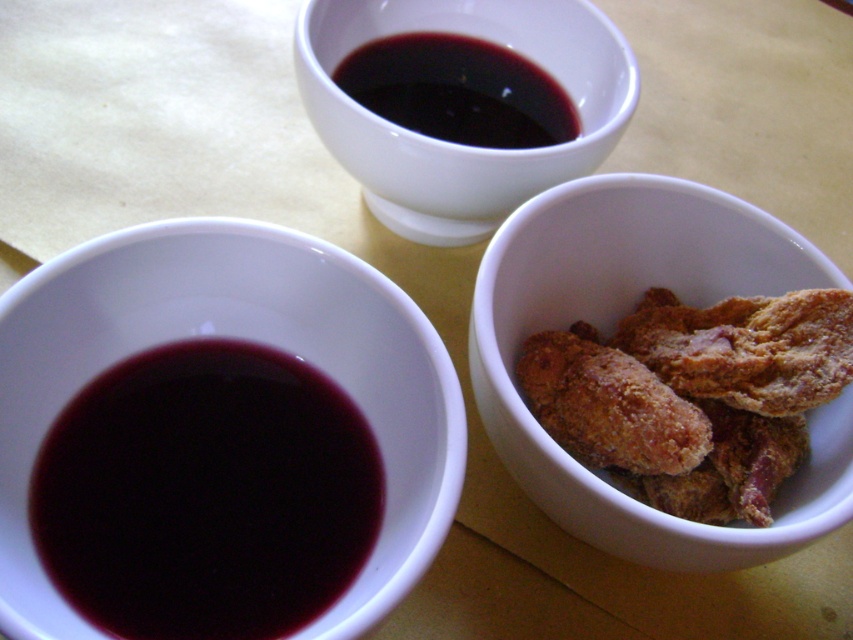
Question: Based on their relative distances, which object is nearer to the dark glossy sauce at upper center?

Choices:
 (A) dark red matte bowl at left
 (B) golden-brown fried snack at center-right
 (C) matte white bowl at upper center

Answer: (C)

Question: Among these objects, which one is nearest to the camera?

Choices:
 (A) golden-brown fried snack at center-right
 (B) dark red matte bowl at left
 (C) dark glossy sauce at upper center

Answer: (B)

Question: Which object is positioned closest to the dark red matte bowl at left?

Choices:
 (A) matte white bowl at upper center
 (B) golden-brown fried snack at center-right
 (C) dark glossy sauce at upper center

Answer: (B)

Question: Considering the relative positions of golden-brown fried snack at center-right and matte white bowl at upper center in the image provided, where is golden-brown fried snack at center-right located with respect to matte white bowl at upper center?

Choices:
 (A) below
 (B) above

Answer: (A)

Question: Is matte white bowl at upper center thinner than dark glossy sauce at upper center?

Choices:
 (A) no
 (B) yes

Answer: (A)

Question: Can you confirm if dark red matte bowl at left is thinner than dark glossy sauce at upper center?

Choices:
 (A) no
 (B) yes

Answer: (A)